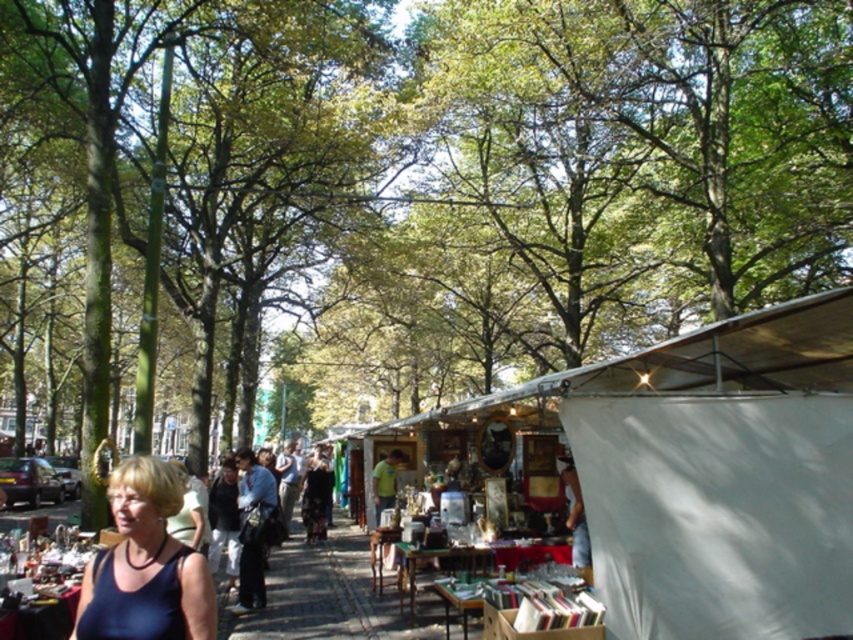
Question: Which object appears farthest from the camera in this image?

Choices:
 (A) matte blue tank top at lower left
 (B) white fabric canopy at center

Answer: (B)

Question: Can you confirm if white fabric canopy at center is positioned to the left of matte blue tank top at lower left?

Choices:
 (A) yes
 (B) no

Answer: (B)

Question: Can you confirm if white fabric canopy at center is wider than matte blue tank top at lower left?

Choices:
 (A) yes
 (B) no

Answer: (A)

Question: Is white fabric canopy at center above matte blue tank top at lower left?

Choices:
 (A) no
 (B) yes

Answer: (A)

Question: Among these points, which one is nearest to the camera?

Choices:
 (A) (154, 461)
 (B) (589, 394)

Answer: (A)